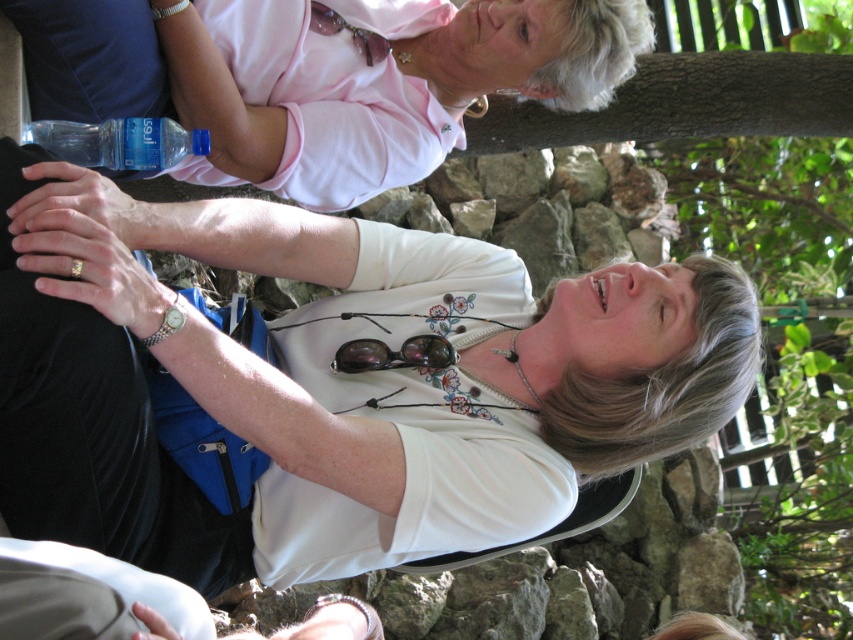
Measure the distance between point (614, 438) and camera.

A distance of 3.26 meters exists between point (614, 438) and camera.

Who is shorter, white matte shirt at center or matte black goggles at center?

matte black goggles at center

Is point (323, 305) closer to viewer compared to point (387, 365)?

No, (323, 305) is further to viewer.

Image resolution: width=853 pixels, height=640 pixels. What are the coordinates of `white matte shirt at center` in the screenshot? It's located at pos(334,384).

Between point (322, 518) and point (233, 164), which one is positioned in front?

Point (322, 518) is more forward.

Is white matte shirt at center to the left of pink fabric shirt at upper center from the viewer's perspective?

No, white matte shirt at center is not to the left of pink fabric shirt at upper center.

The width and height of the screenshot is (853, 640). Describe the element at coordinates (334, 384) in the screenshot. I see `white matte shirt at center` at that location.

The image size is (853, 640). Find the location of `white matte shirt at center`. white matte shirt at center is located at coordinates (x=334, y=384).

Between point (378, 177) and point (383, 369), which one is positioned in front?

Point (383, 369)

Does pink fabric shirt at upper center have a larger size compared to matte black goggles at center?

Correct, pink fabric shirt at upper center is larger in size than matte black goggles at center.

Which is behind, point (418, 148) or point (405, 339)?

Point (418, 148)

Where is `pink fabric shirt at upper center`? pink fabric shirt at upper center is located at coordinates (379, 81).